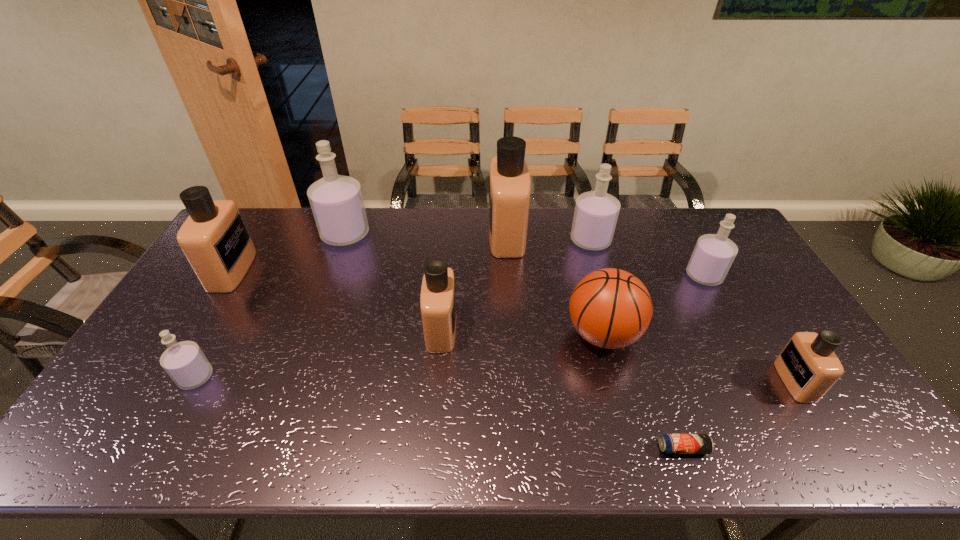
Where is `the sixth object from right to left`? This screenshot has height=540, width=960. the sixth object from right to left is located at coordinates (509, 180).

Where is `the biggest beige perfume`? Image resolution: width=960 pixels, height=540 pixels. the biggest beige perfume is located at coordinates (509, 180).

The image size is (960, 540). I want to click on the eighth object from right to left, so click(x=336, y=201).

Where is `the biggest purple perfume`? the biggest purple perfume is located at coordinates (336, 201).

This screenshot has width=960, height=540. In order to click on the third smallest beige perfume in this screenshot , I will do `click(214, 238)`.

This screenshot has height=540, width=960. Find the location of `the second biggest purple perfume`. the second biggest purple perfume is located at coordinates (596, 212).

You are a GUI agent. You are given a task and a screenshot of the screen. Output one action in this format:
    pyautogui.click(x=<x>, y=<y>)
    Task: Click on the second purple perfume from right to left
    The image size is (960, 540).
    Given the screenshot: What is the action you would take?
    pyautogui.click(x=596, y=212)

Image resolution: width=960 pixels, height=540 pixels. Identify the location of the third biggest purple perfume. (713, 255).

Where is `the rightmost purple perfume`? Image resolution: width=960 pixels, height=540 pixels. the rightmost purple perfume is located at coordinates (713, 255).

This screenshot has width=960, height=540. What are the coordinates of `the third nearest perfume` in the screenshot? It's located at (437, 299).